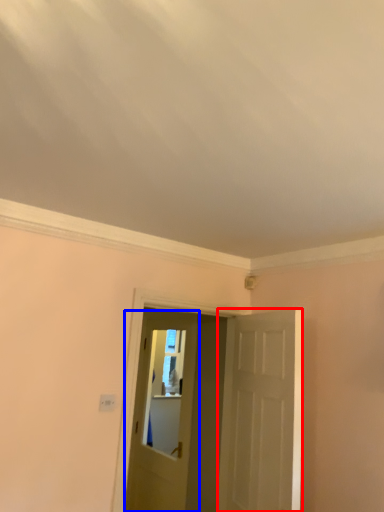
Question: Among these objects, which one is farthest to the camera, door (highlighted by a red box) or door (highlighted by a blue box)?

Choices:
 (A) door
 (B) door

Answer: (B)